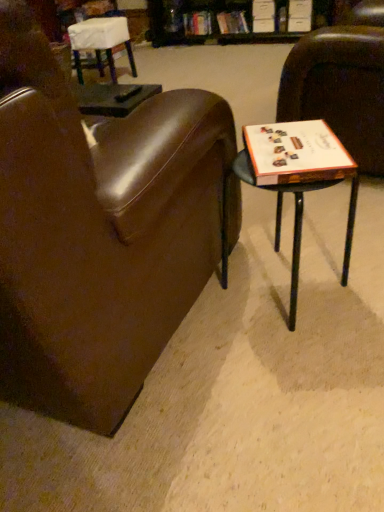
At what (x,y) coordinates should I click in order to perform the action: click on empty space that is in between brown leather chair at center, which appears as the second chair when viewed from the left, and wooden table at right. Please return your answer as a coordinate pair (x, y). Looking at the image, I should click on (231, 367).